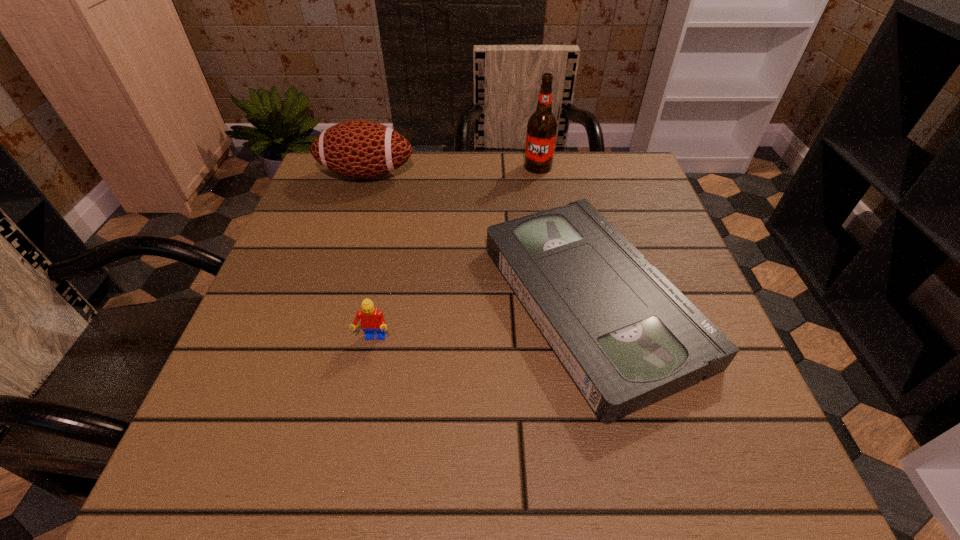
Locate an element on the screen. The image size is (960, 540). unoccupied position between the Lego and the root beer is located at coordinates (456, 253).

Find the location of `unoccupied area between the second shortest object and the football`. unoccupied area between the second shortest object and the football is located at coordinates (370, 256).

Locate an element on the screen. empty space between the Lego and the tallest object is located at coordinates (456, 253).

You are a GUI agent. You are given a task and a screenshot of the screen. Output one action in this format:
    pyautogui.click(x=<x>, y=<y>)
    Task: Click on the free space between the football and the root beer
    The image size is (960, 540).
    Given the screenshot: What is the action you would take?
    pyautogui.click(x=452, y=171)

Find the location of a particular element. This screenshot has height=540, width=960. unoccupied area between the third shortest object and the second shortest object is located at coordinates (370, 256).

At what (x,y) coordinates should I click in order to perform the action: click on empty location between the second shortest object and the root beer. Please return your answer as a coordinate pair (x, y). This screenshot has width=960, height=540. Looking at the image, I should click on (456, 253).

Locate an element on the screen. The height and width of the screenshot is (540, 960). unoccupied area between the videotape and the third tallest object is located at coordinates coord(482,320).

Select which object appears as the third closest to the Lego. Please provide its 2D coordinates. Your answer should be formatted as a tuple, i.e. [(x, y)], where the tuple contains the x and y coordinates of a point satisfying the conditions above.

[(542, 125)]

Select which object appears as the third closest to the videotape. Please provide its 2D coordinates. Your answer should be formatted as a tuple, i.e. [(x, y)], where the tuple contains the x and y coordinates of a point satisfying the conditions above.

[(360, 149)]